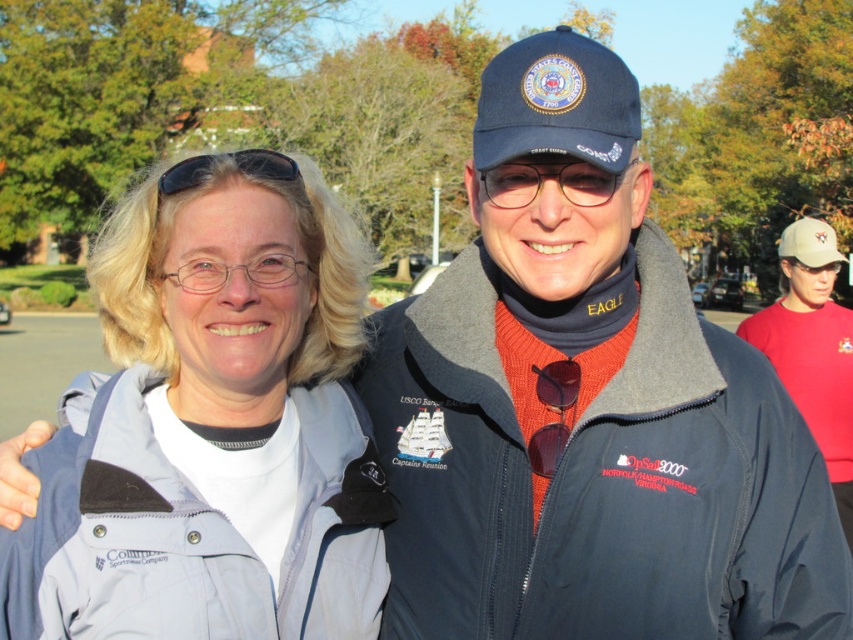
You are a photographer trying to capture a closeup shot of the clear plastic glasses at center and the black rubber goggles at upper center. Since your camera has a limited field of view, you need to know which object is wider to frame the shot properly. Which of the two objects is wider?

The clear plastic glasses at center is wider than the black rubber goggles at upper center, so you should frame the shot to accommodate its width.

You are a photographer trying to capture a clear shot of both the gray fabric jacket at left and the black rubber goggles at upper center. Given that your camera has a fixed focus, which object should you prioritize focusing on to ensure it appears sharp, considering their sizes?

The gray fabric jacket at left is larger than the black rubber goggles at upper center, so focusing on the gray fabric jacket at left would ensure it appears sharp due to its larger size.

Consider the image. You are a photographer at an event and need to capture a closeup of the gray fabric jacket at left and the clear plastic glasses at center. Which object should you focus on first if you want to start with the one closer to the left side?

The gray fabric jacket at left is positioned on the left side of clear plastic glasses at center, so you should focus on the gray fabric jacket at left first since it is closer to the left side.